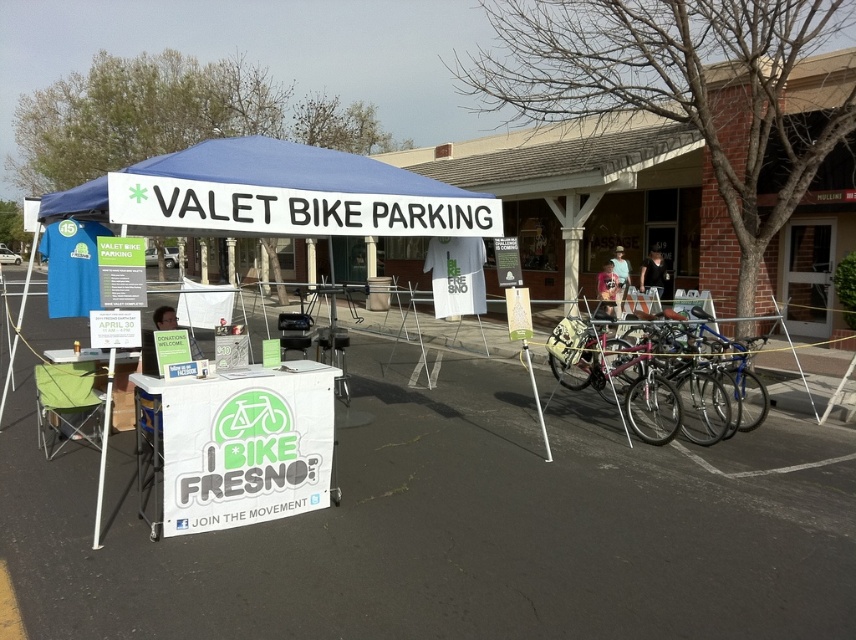
Does blue fabric tent at center have a larger size compared to white plastic pole at lower left?

No, blue fabric tent at center is not bigger than white plastic pole at lower left.

Is blue fabric tent at center thinner than white plastic pole at lower left?

Yes, blue fabric tent at center is thinner than white plastic pole at lower left.

Locate an element on the screen. Image resolution: width=856 pixels, height=640 pixels. blue fabric tent at center is located at coordinates (274, 195).

Can you confirm if blue fabric canopy at center is bigger than matte green signboard at center?

No.

Is blue fabric canopy at center below matte green signboard at center?

No.

Is point (171, 173) positioned after point (200, 355)?

No, (171, 173) is closer to viewer.

Identify the location of blue fabric canopy at center. (276, 195).

Which is in front, point (343, 156) or point (617, 376)?

Point (343, 156) is more forward.

Does point (155, 230) come behind point (643, 442)?

No, it is in front of (643, 442).

You are a GUI agent. You are given a task and a screenshot of the screen. Output one action in this format:
    pyautogui.click(x=<x>, y=<y>)
    Task: Click on the blue fabric tent at center
    Image resolution: width=856 pixels, height=640 pixels.
    Given the screenshot: What is the action you would take?
    pyautogui.click(x=274, y=195)